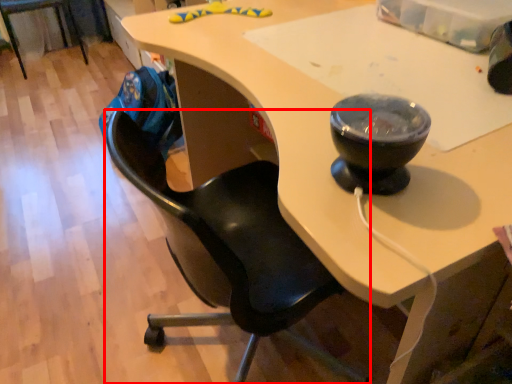
Question: From the image's perspective, what is the correct spatial positioning of chair (annotated by the red box) in reference to chair?

Choices:
 (A) below
 (B) above

Answer: (A)